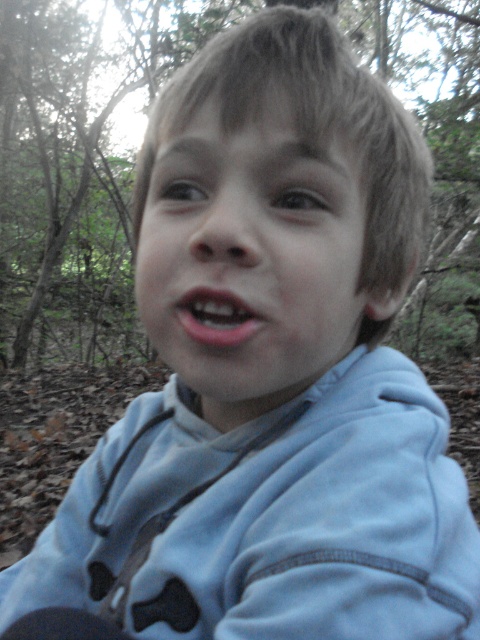
You are a photographer standing at a distance. You want to capture a closeup shot of the light blue fleece jacket at center. Based on the description, is the jacket within your camera lens range if your camera can focus as close as 10 inches?

The light blue fleece jacket at center and viewer are 10.11 inches apart. Since the camera can focus as close as 10 inches, the jacket is just slightly out of focus range. You might need to adjust your position or use a macro lens for a clear closeup.

Based on the scene description, you are a photographer trying to capture a closeup of the child in the wooded area. You notice the smooth skin face at center and the pink matte lips at center. Which of these two features is positioned higher on the child?

The smooth skin face at center is taller than the pink matte lips at center, so the smooth skin face at center is positioned higher on the child.

The child is wearing a light blue fleece jacket at center and has a smooth skin face at center. If you were to take a photo of the child from above, which object would appear larger in the photo?

The light blue fleece jacket at center would appear larger in the photo because it is bigger than the smooth skin face at center.